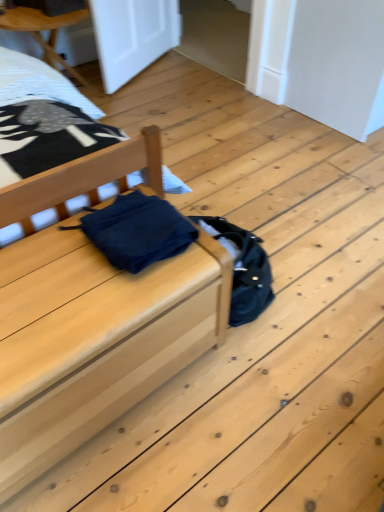
Question: From a real-world perspective, is dark blue fabric at center located beneath matte wood bed at center?

Choices:
 (A) yes
 (B) no

Answer: (B)

Question: Is dark blue fabric at center not within matte wood bed at center?

Choices:
 (A) no
 (B) yes

Answer: (B)

Question: From the image's perspective, does dark blue fabric at center appear higher than matte wood bed at center?

Choices:
 (A) no
 (B) yes

Answer: (B)

Question: Is dark blue fabric at center at the left side of matte wood bed at center?

Choices:
 (A) no
 (B) yes

Answer: (A)

Question: From a real-world perspective, is dark blue fabric at center located higher than matte wood bed at center?

Choices:
 (A) yes
 (B) no

Answer: (A)

Question: From the image's perspective, is dark blue fabric at center above or below matte wood bed at center?

Choices:
 (A) below
 (B) above

Answer: (B)

Question: Does point (89, 238) appear closer or farther from the camera than point (59, 315)?

Choices:
 (A) farther
 (B) closer

Answer: (A)

Question: Based on their sizes in the image, would you say dark blue fabric at center is bigger or smaller than matte wood bed at center?

Choices:
 (A) small
 (B) big

Answer: (A)

Question: Is dark blue fabric at center inside or outside of matte wood bed at center?

Choices:
 (A) inside
 (B) outside

Answer: (B)

Question: Is white textured sheet at upper left taller or shorter than matte blue fabric at center?

Choices:
 (A) tall
 (B) short

Answer: (B)

Question: From the image's perspective, is white textured sheet at upper left located above or below matte blue fabric at center?

Choices:
 (A) above
 (B) below

Answer: (A)

Question: Considering the positions of white textured sheet at upper left and matte blue fabric at center in the image, is white textured sheet at upper left wider or thinner than matte blue fabric at center?

Choices:
 (A) wide
 (B) thin

Answer: (B)

Question: Is white textured sheet at upper left to the left or to the right of matte blue fabric at center in the image?

Choices:
 (A) left
 (B) right

Answer: (A)

Question: Is matte wood bed at center inside or outside of dark blue fabric at center?

Choices:
 (A) inside
 (B) outside

Answer: (B)

Question: Considering the positions of point (44, 284) and point (187, 232), is point (44, 284) closer or farther from the camera than point (187, 232)?

Choices:
 (A) closer
 (B) farther

Answer: (A)